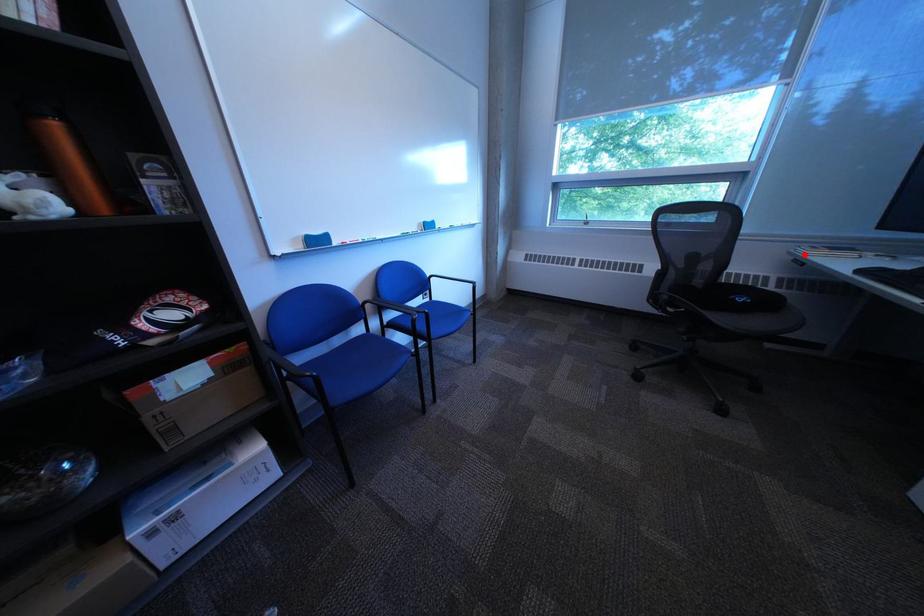
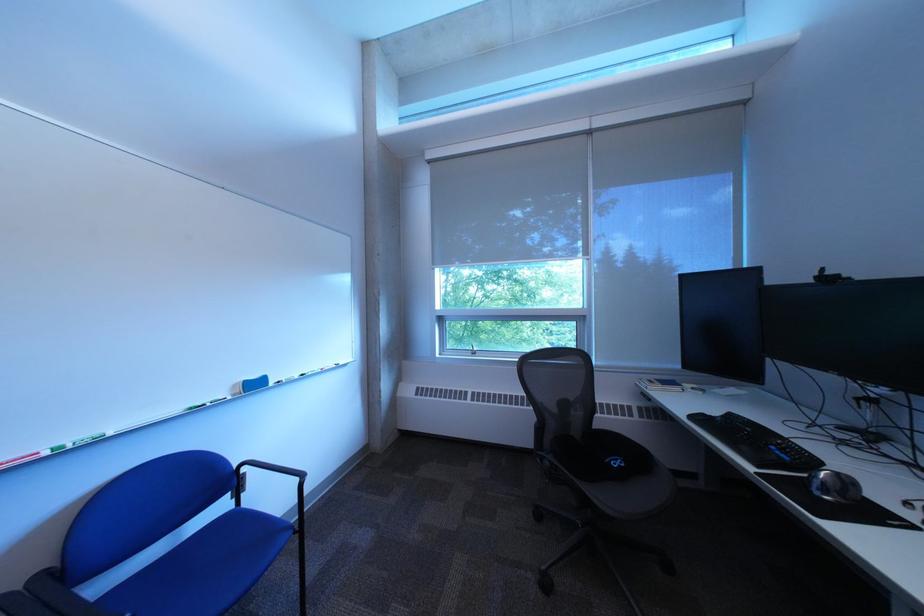
The point at the highlighted location is marked in the first image. Where is the corresponding point in the second image?

(651, 386)